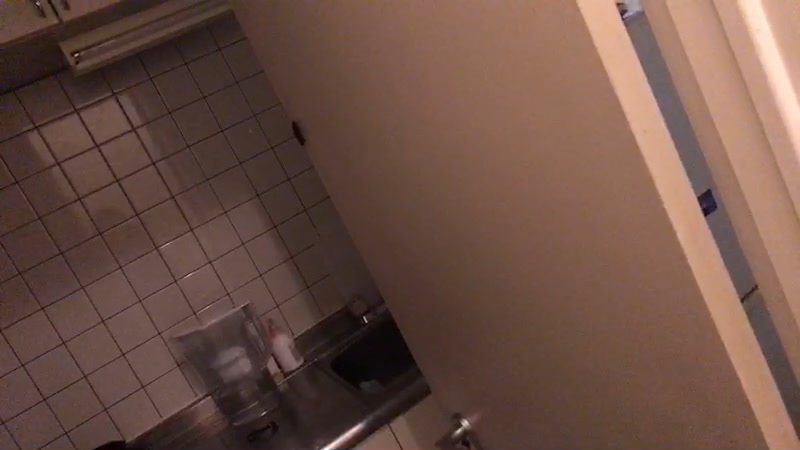
You are a GUI agent. You are given a task and a screenshot of the screen. Output one action in this format:
    pyautogui.click(x=<x>, y=<y>)
    Task: Click on the door handle
    The image size is (800, 450).
    Given the screenshot: What is the action you would take?
    pyautogui.click(x=458, y=434)